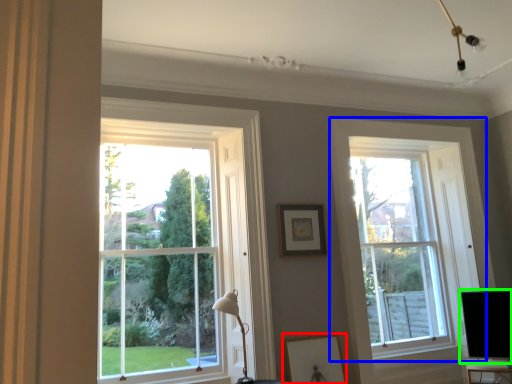
Question: Which is nearer to the picture frame (highlighted by a red box)? window (highlighted by a blue box) or computer monitor (highlighted by a green box).

Choices:
 (A) window
 (B) computer monitor

Answer: (A)